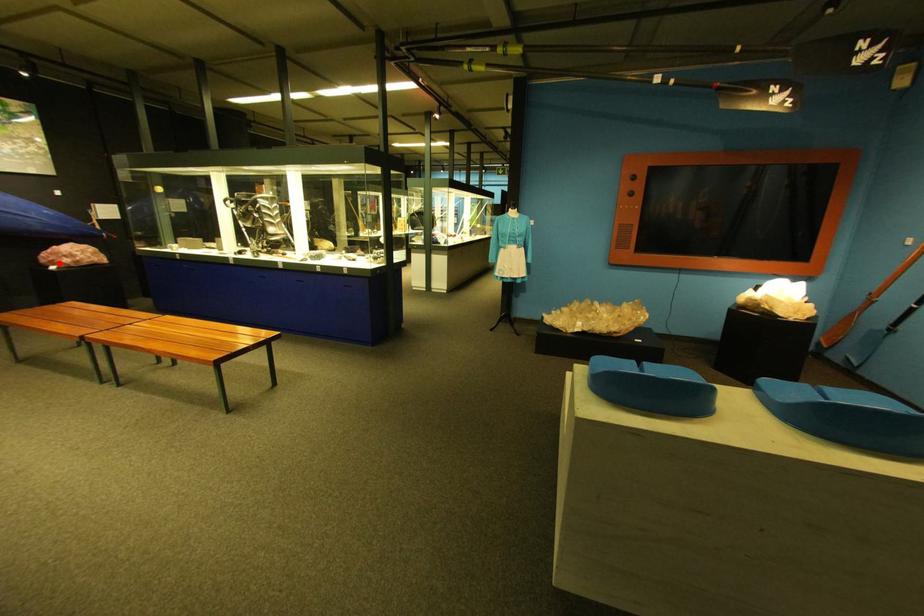
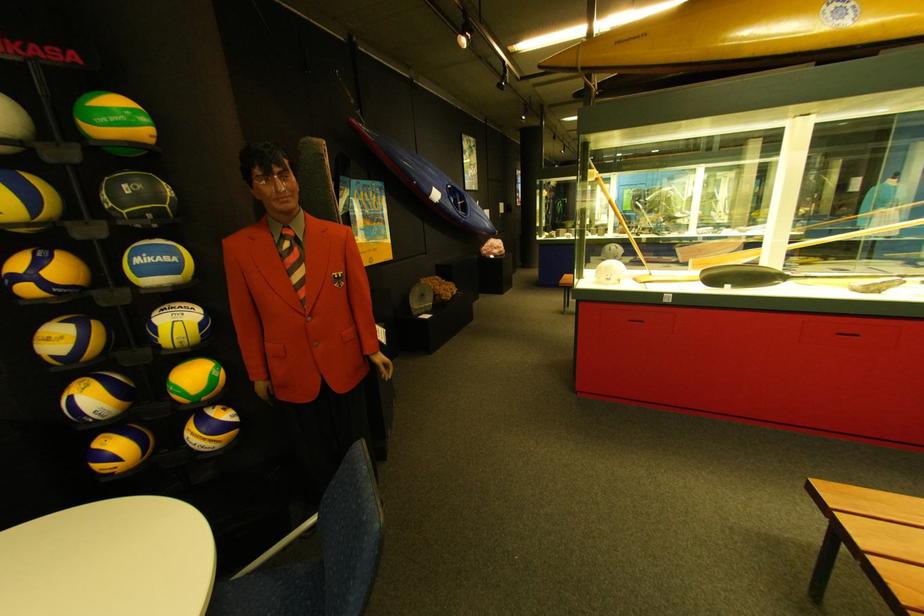
Question: A red point is marked in image1. In image2, is the corresponding 3D point closer to the camera or farther? Reply with the corresponding letter.

Choices:
 (A) The corresponding 3D point is closer.
 (B) The corresponding 3D point is farther.

Answer: (A)